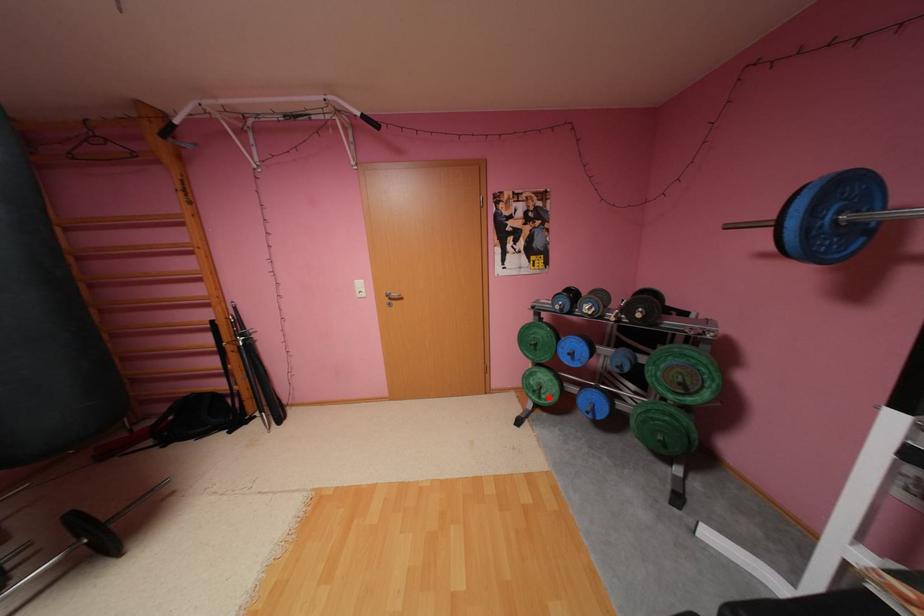
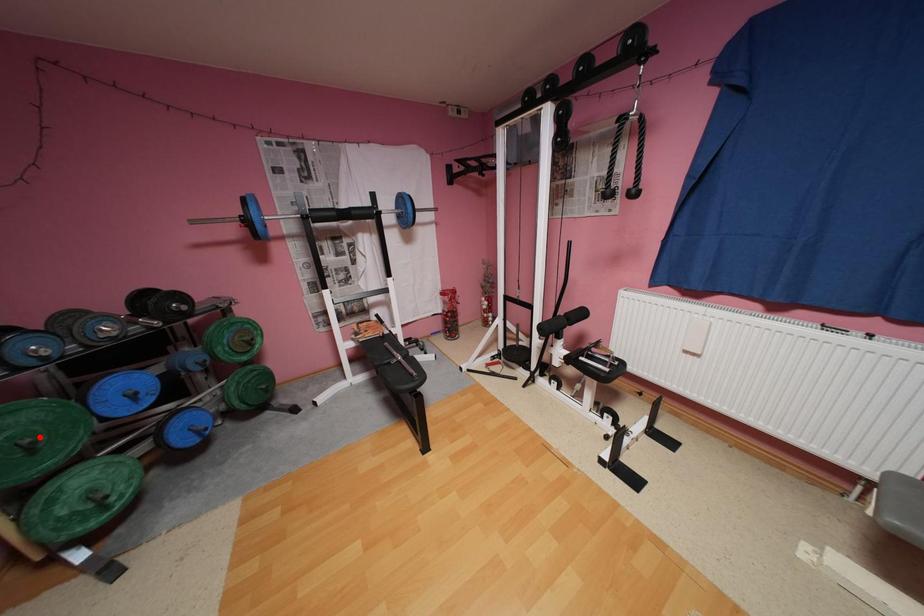
I am providing you with two images of the same scene from different viewpoints. A red point is marked on the first image and another point is marked on the second image. Is the marked point in image1 the same physical position as the marked point in image2?

No